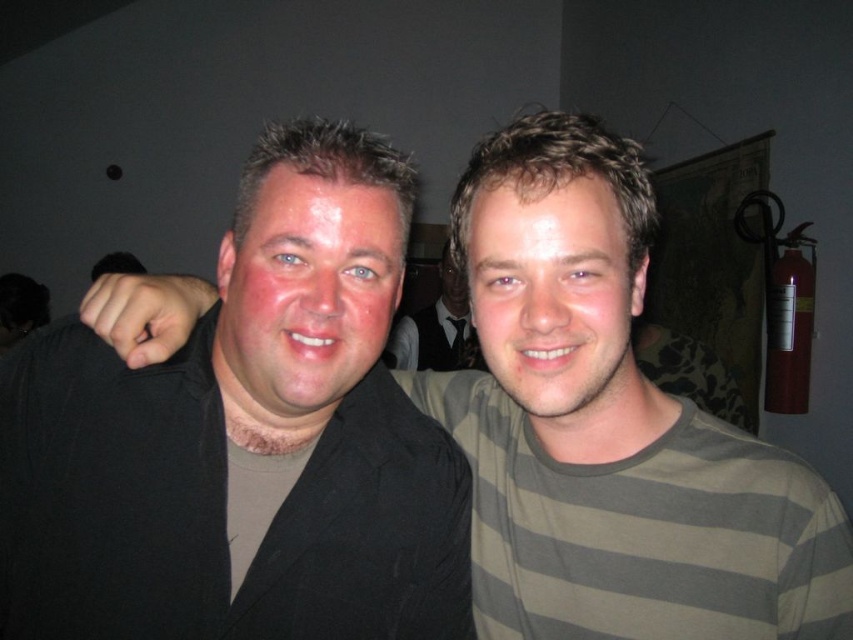
Between brown striped shirt at center and matte black shirt at center, which one appears on the left side from the viewer's perspective?

Positioned to the left is matte black shirt at center.

Which is in front, point (532, 348) or point (410, 326)?

Positioned in front is point (532, 348).

Where is `brown striped shirt at center`? The height and width of the screenshot is (640, 853). brown striped shirt at center is located at coordinates (555, 298).

Is black matte jacket at left bigger than matte black shirt at center?

No.

Can you confirm if black matte jacket at left is positioned to the left of matte black shirt at center?

Correct, you'll find black matte jacket at left to the left of matte black shirt at center.

Between point (355, 612) and point (439, 298), which one is positioned behind?

The point (439, 298) is more distant.

This screenshot has height=640, width=853. What are the coordinates of `black matte jacket at left` in the screenshot? It's located at (244, 440).

Does matte black face at center appear on the left side of matte black shirt at center?

Indeed, matte black face at center is positioned on the left side of matte black shirt at center.

From the picture: Is matte black face at center bigger than matte black shirt at center?

Incorrect, matte black face at center is not larger than matte black shirt at center.

Locate an element on the screen. Image resolution: width=853 pixels, height=640 pixels. matte black face at center is located at coordinates (306, 292).